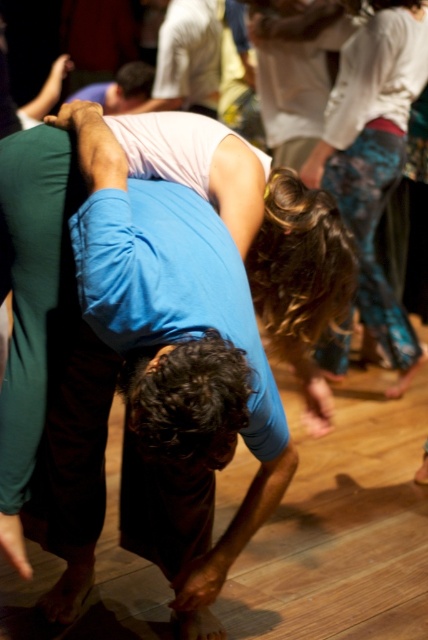
Where is the blue cotton shirt at center located in the image?

The blue cotton shirt at center is located at point (155,380).

You are a photographer trying to capture a group photo of the participants in the dance class. You want to ensure that both the white cotton shirt at upper center and the white matte shirt at upper center are in focus. Given that your camera can only focus on objects within a 15 inch range, will both shirts be in focus?

The distance between the white cotton shirt at upper center and the white matte shirt at upper center is 20.77 inches, which exceeds the camera focus range of 15 inches. Therefore, both shirts cannot be in focus simultaneously.